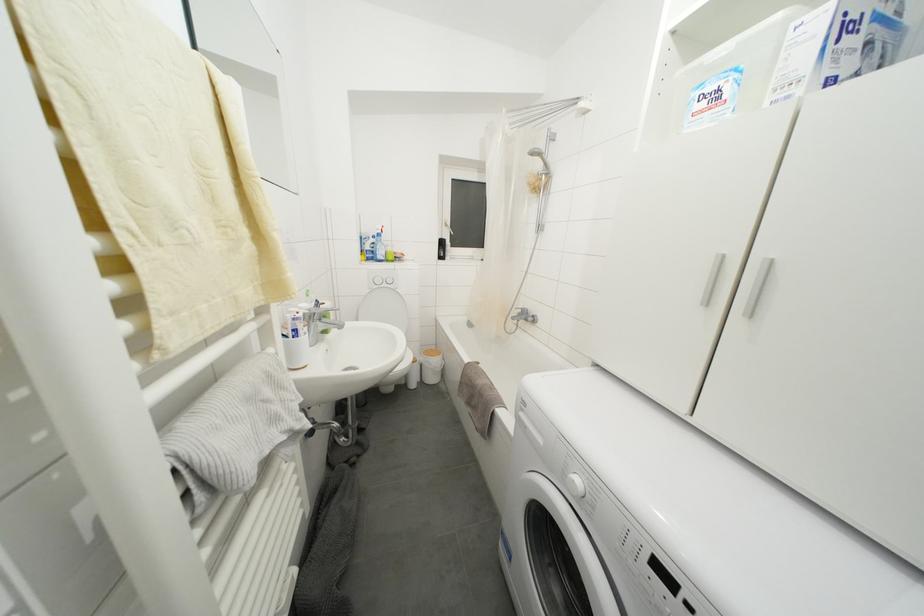
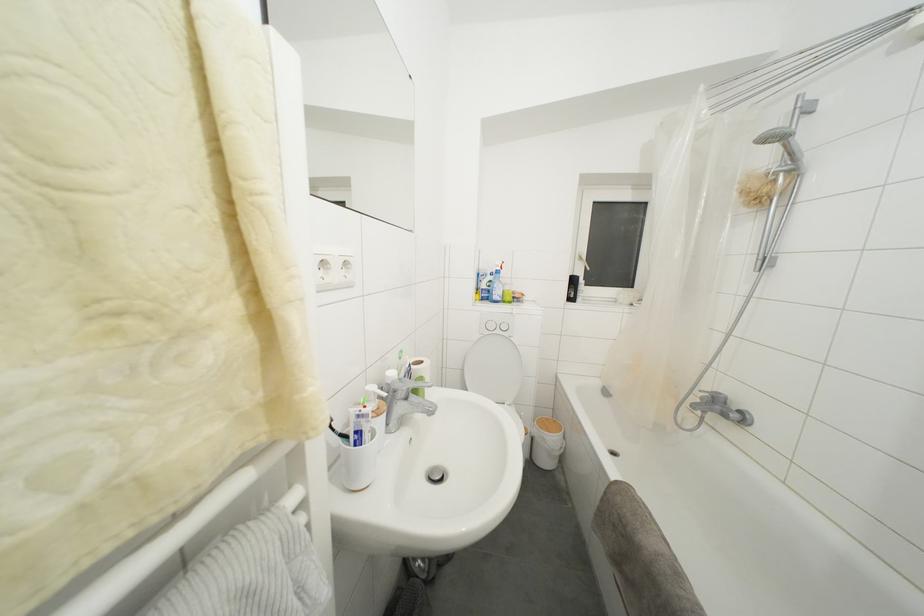
Question: I am providing you with two images of the same scene from different viewpoints. Please identify which objects are invisible in image2.

Choices:
 (A) black bottle
 (B) faucet handle
 (C) toilet paper roll
 (D) none of these

Answer: (D)